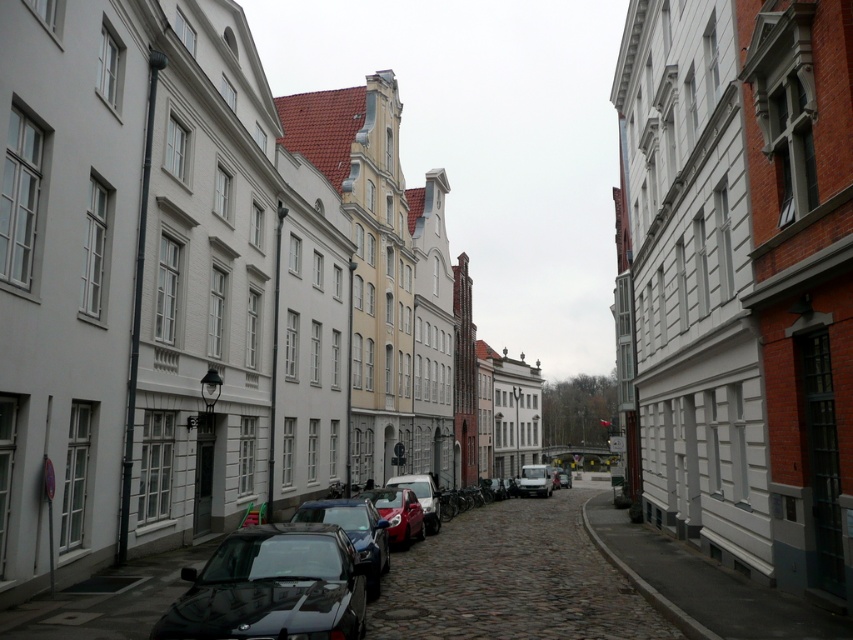
Is point (769, 637) farther from viewer compared to point (529, 486)?

No, (769, 637) is in front of (529, 486).

Between white smooth wall at lower right and matte silver van at center, which one is positioned lower?

Positioned lower is matte silver van at center.

Where is `white smooth wall at lower right`? white smooth wall at lower right is located at coordinates [x=706, y=586].

Can you confirm if white smooth wall at lower right is shorter than metallic silver car at center?

No, white smooth wall at lower right is not shorter than metallic silver car at center.

The image size is (853, 640). Identify the location of white smooth wall at lower right. [706, 586].

This screenshot has width=853, height=640. What are the coordinates of `white smooth wall at lower right` in the screenshot? It's located at (706, 586).

Consider the image. Does shiny red car at center lie in front of metallic silver car at center?

Yes.

From the picture: Can you confirm if shiny red car at center is wider than metallic silver car at center?

Incorrect, shiny red car at center's width does not surpass metallic silver car at center's.

Describe the element at coordinates (398, 513) in the screenshot. I see `shiny red car at center` at that location.

Where is `shiny red car at center`? shiny red car at center is located at coordinates (398, 513).